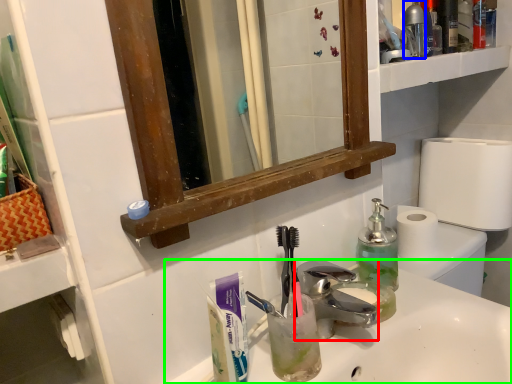
Question: Which is nearer to the faucet (highlighted by a red box)? bottle (highlighted by a blue box) or sink (highlighted by a green box).

Choices:
 (A) bottle
 (B) sink

Answer: (B)